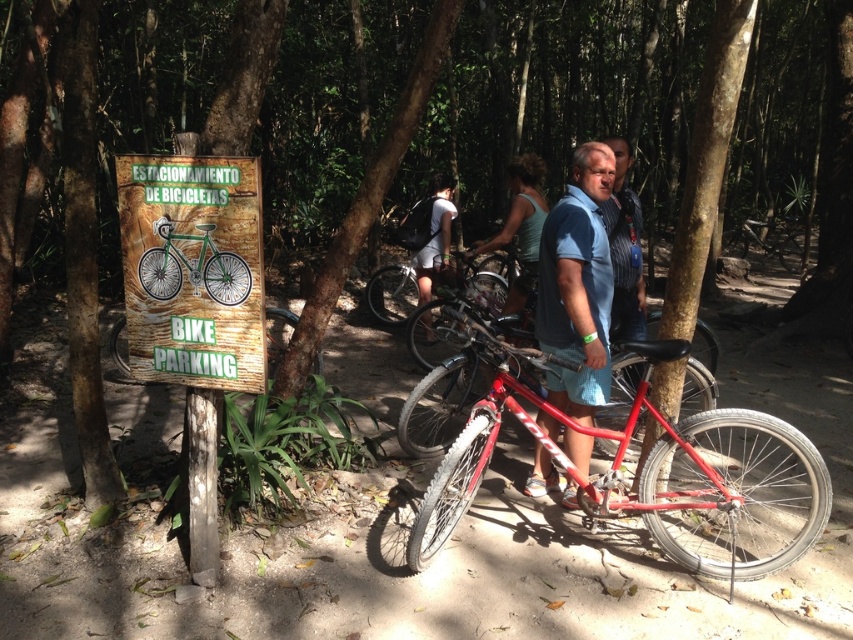
Question: Among these objects, which one is farthest from the camera?

Choices:
 (A) matte black backpack at center
 (B) metallic blue shirt at center

Answer: (A)

Question: Does metallic blue shirt at center have a greater width compared to blue fabric shirt at center?

Choices:
 (A) no
 (B) yes

Answer: (B)

Question: Estimate the real-world distances between objects in this image. Which object is farther from the green wood sign at upper left?

Choices:
 (A) shiny metallic bicycle at center
 (B) blue denim shirt at center
 (C) matte green tank top at center

Answer: (A)

Question: Is shiny red bicycle at center closer to camera compared to green wood sign at upper left?

Choices:
 (A) no
 (B) yes

Answer: (A)

Question: Which of the following is the closest to the observer?

Choices:
 (A) (421, 202)
 (B) (489, 256)

Answer: (A)

Question: Is matte green tank top at center below matte black backpack at center?

Choices:
 (A) yes
 (B) no

Answer: (A)